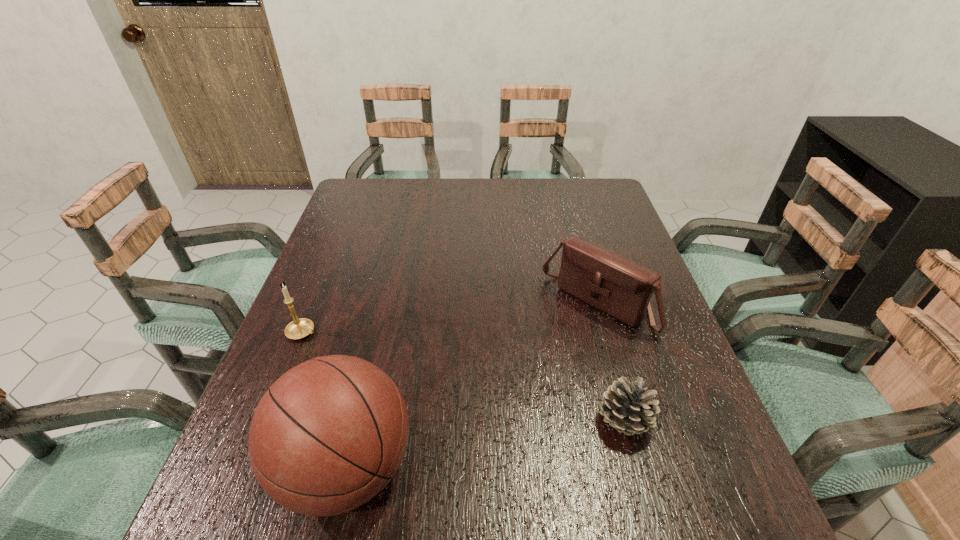
At what (x,y) coordinates should I click in order to perform the action: click on pinecone. Please return your answer as a coordinate pair (x, y). Looking at the image, I should click on (628, 408).

Where is `shoulder bag`? The height and width of the screenshot is (540, 960). shoulder bag is located at coordinates coord(615,285).

The height and width of the screenshot is (540, 960). Identify the location of candle holder. (299, 328).

Locate an element on the screen. The image size is (960, 540). vacant space situated on the left of the shortest object is located at coordinates (563, 422).

Identify the location of vacant space located 0.300m on the front flap of the shoulder bag. The image size is (960, 540). (489, 419).

At what (x,y) coordinates should I click in order to perform the action: click on vacant space located on the front flap of the shoulder bag. Please return your answer as a coordinate pair (x, y). Looking at the image, I should click on (527, 377).

Find the location of a particular element. Image resolution: width=960 pixels, height=540 pixels. free space located on the front flap of the shoulder bag is located at coordinates (530, 375).

Where is `vacant region located 0.350m on the handle side of the leftmost object`? Image resolution: width=960 pixels, height=540 pixels. vacant region located 0.350m on the handle side of the leftmost object is located at coordinates (445, 396).

The image size is (960, 540). Identify the location of vacant space situated 0.340m on the handle side of the leftmost object. (441, 394).

Where is `vacant space located on the handle side of the leftmost object`? The image size is (960, 540). vacant space located on the handle side of the leftmost object is located at coordinates (340, 348).